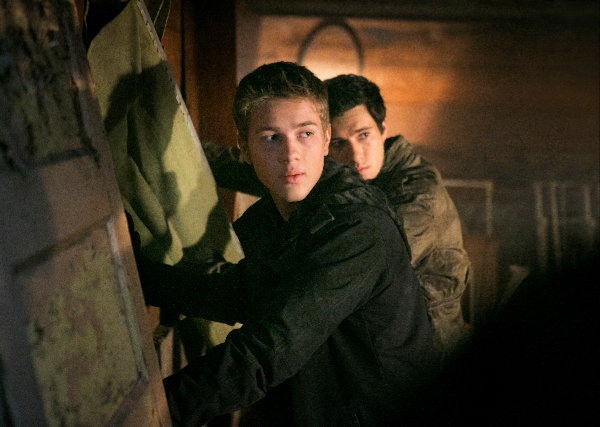
The width and height of the screenshot is (600, 427). In order to click on wooden wall in this screenshot , I will do `click(424, 84)`.